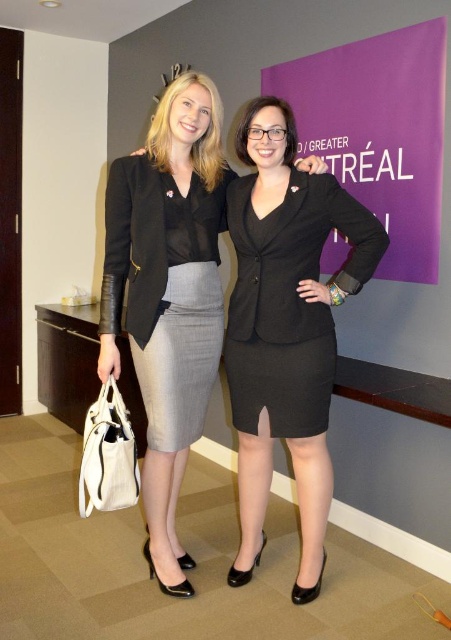
Question: Is matte black blazer at center to the left of purple matte bulletin board at upper right from the viewer's perspective?

Choices:
 (A) yes
 (B) no

Answer: (A)

Question: Can you confirm if purple matte bulletin board at upper right is positioned to the left of gray textured skirt at center?

Choices:
 (A) no
 (B) yes

Answer: (A)

Question: Which of the following is the closest to the observer?

Choices:
 (A) gray textured skirt at center
 (B) matte black blazer at center
 (C) purple matte bulletin board at upper right
 (D) black matte dress at center

Answer: (D)

Question: Which of the following is the closest to the observer?

Choices:
 (A) gray textured skirt at center
 (B) purple matte bulletin board at upper right
 (C) black matte dress at center

Answer: (C)

Question: Which of the following is the closest to the observer?

Choices:
 (A) black matte dress at center
 (B) matte black blazer at center

Answer: (A)

Question: Considering the relative positions of matte black blazer at center and purple matte bulletin board at upper right in the image provided, where is matte black blazer at center located with respect to purple matte bulletin board at upper right?

Choices:
 (A) above
 (B) below

Answer: (B)